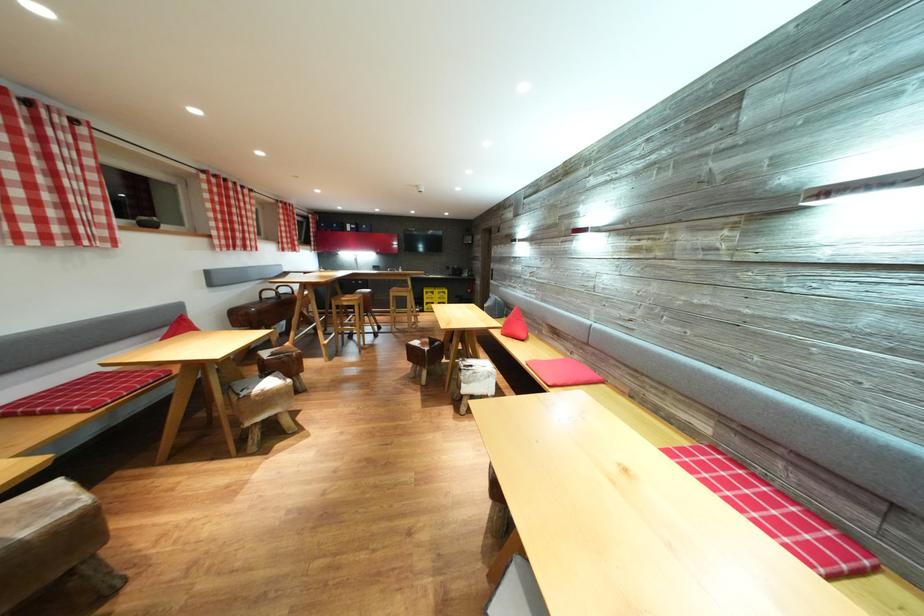
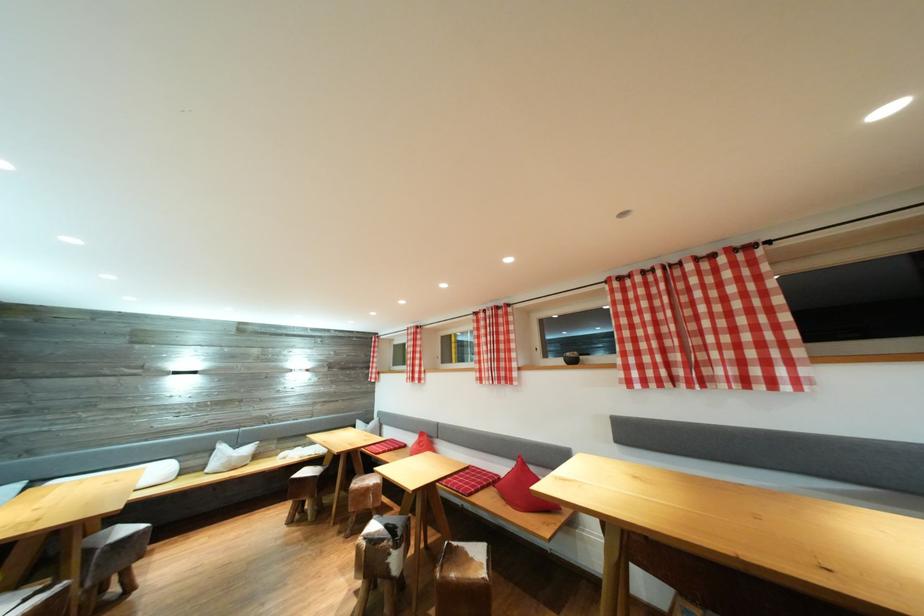
In the second image, find the point that corresponds to the point at 220,177 in the first image.

(631, 278)